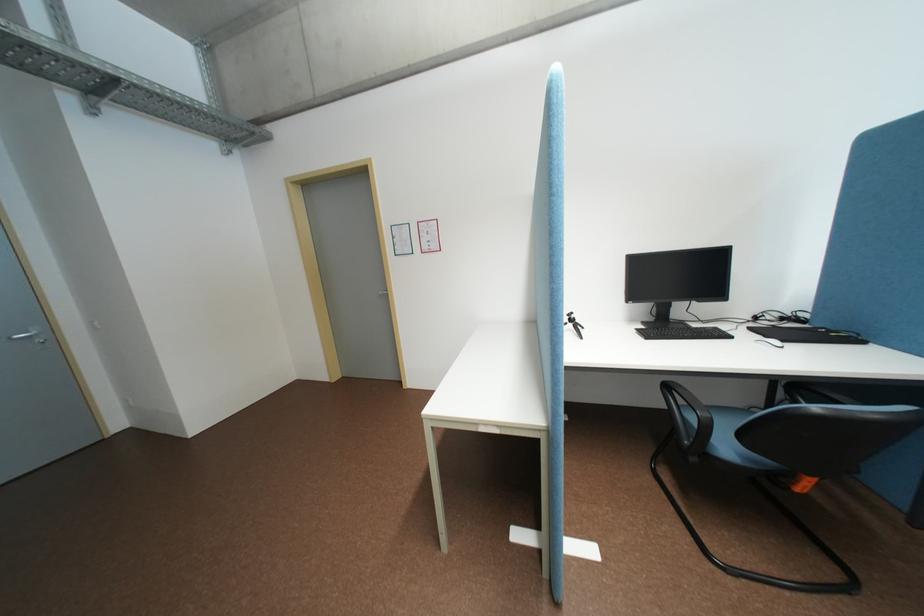
At what (x,y) coordinates should I click in order to perform the action: click on black chair armrest. Please return your answer as a coordinate pair (x, y). This screenshot has height=616, width=924. Looking at the image, I should click on (687, 419).